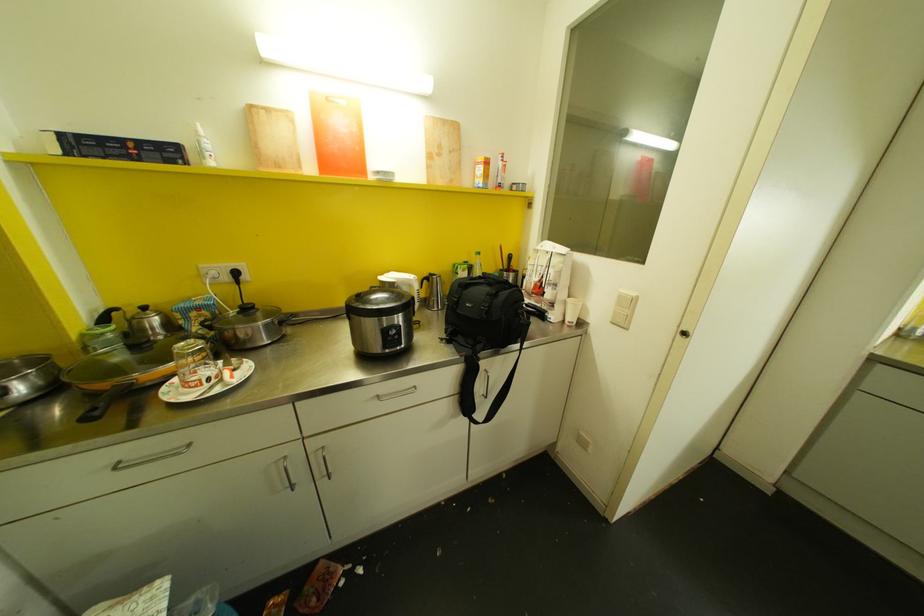
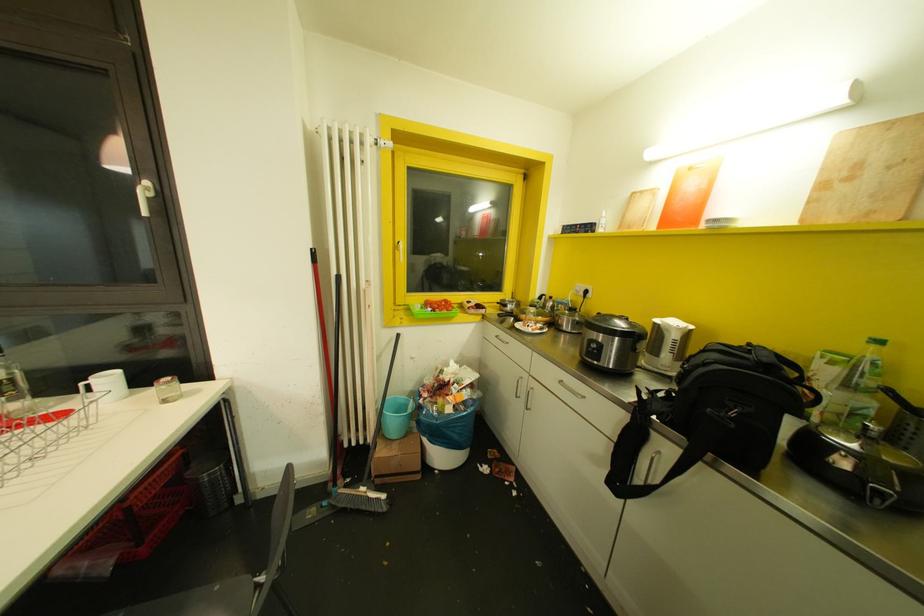
Question: The camera is either moving clockwise (left) or counter-clockwise (right) around the object. The first image is from the beginning of the video and the second image is from the end. Is the camera moving left or right when shooting the video?

Choices:
 (A) Left
 (B) Right

Answer: (B)